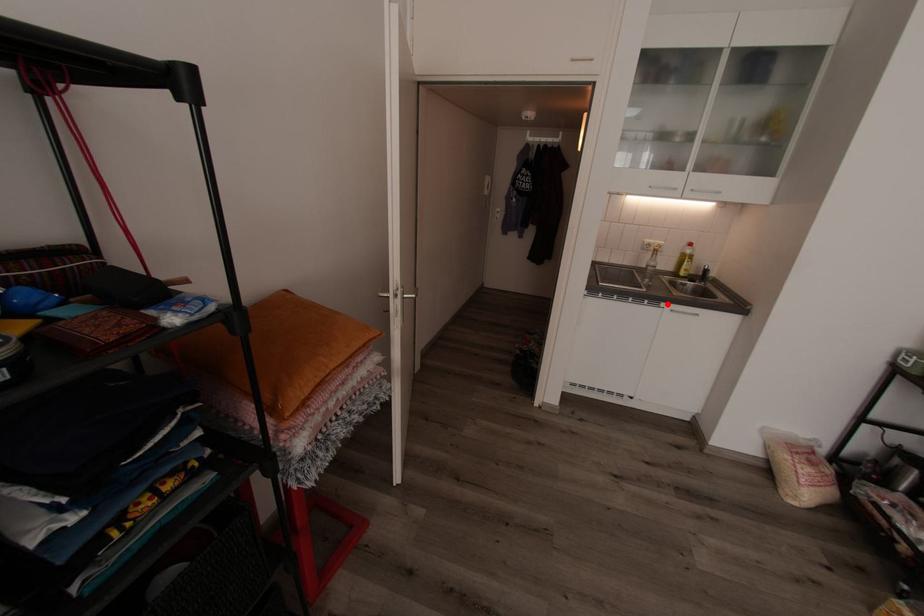
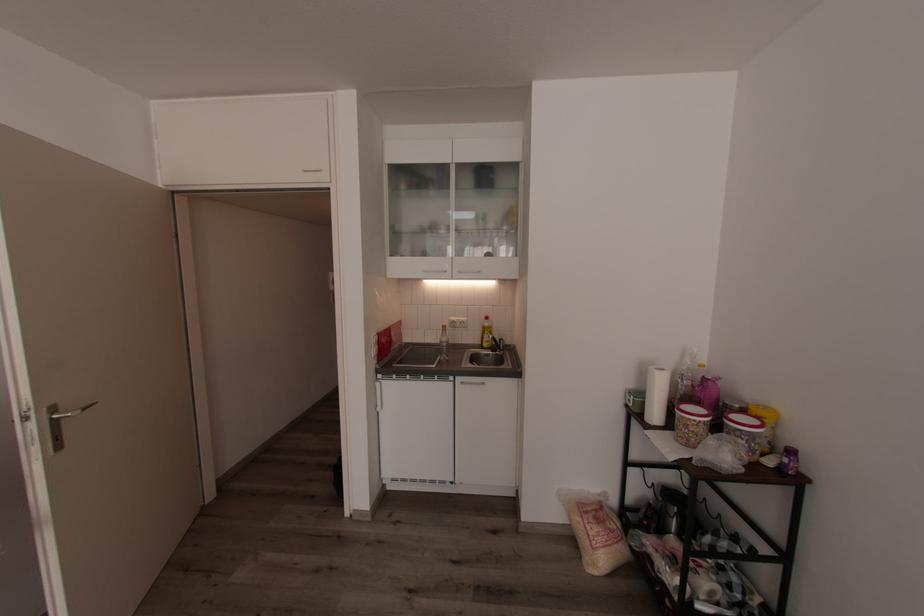
Find the pixel in the second image that matches the highlighted location in the first image.

(456, 378)